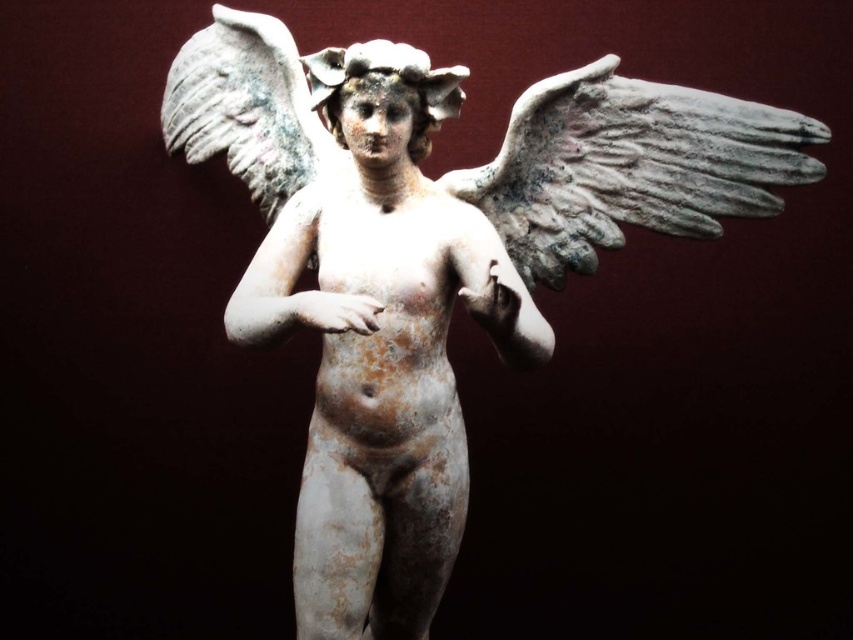
Is white stone wing at center thinner than gray stone wing at center?

No.

Locate an element on the screen. white stone wing at center is located at coordinates (630, 166).

Is white stone cherub at center to the left of gray stone wing at center from the viewer's perspective?

Yes, white stone cherub at center is to the left of gray stone wing at center.

Does point (379, 134) come in front of point (647, 122)?

Yes, point (379, 134) is closer to viewer.

Between point (403, 333) and point (601, 184), which one is positioned in front?

Point (403, 333) is in front.

Identify the location of white stone cherub at center. (381, 346).

Which of these two, white stone cherub at center or white stone wing at center, stands taller?

With more height is white stone cherub at center.

Is white stone cherub at center taller than white stone wing at center?

Indeed, white stone cherub at center has a greater height compared to white stone wing at center.

Which is in front, point (378, 257) or point (477, 180)?

Point (378, 257) is more forward.

The width and height of the screenshot is (853, 640). In order to click on white stone cherub at center in this screenshot , I will do `click(381, 346)`.